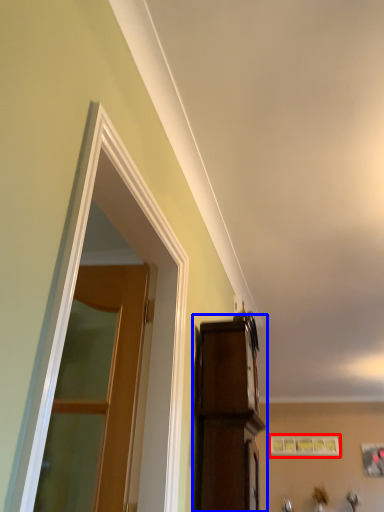
Question: Among these objects, which one is nearest to the camera, picture frame (highlighted by a red box) or cabinetry (highlighted by a blue box)?

Choices:
 (A) picture frame
 (B) cabinetry

Answer: (B)